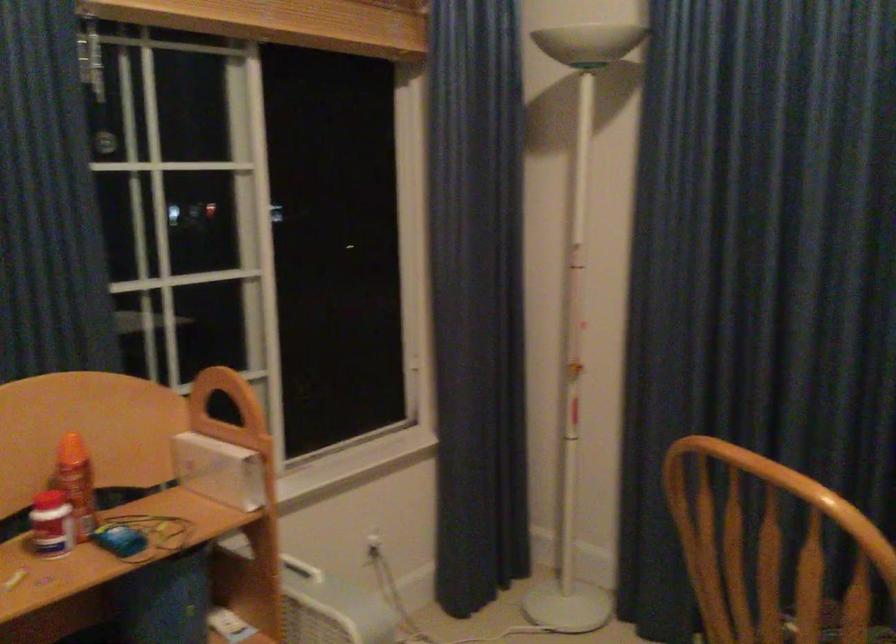
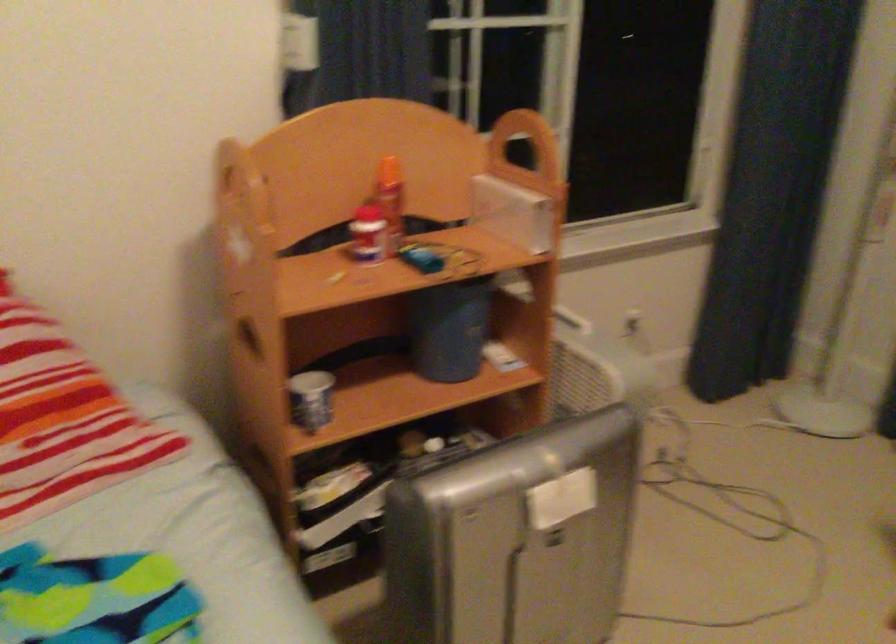
In the second image, find the point that corresponds to (220,384) in the first image.

(512, 128)